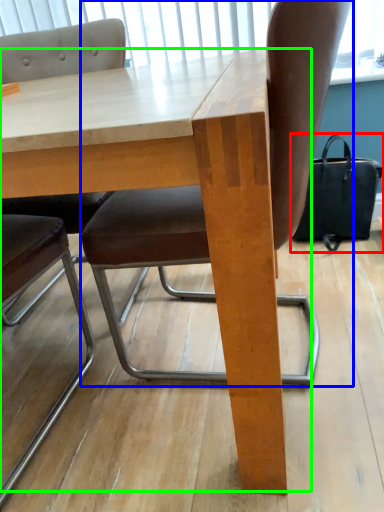
Question: Considering the real-world distances, which object is farthest from handbag (highlighted by a red box)? chair (highlighted by a blue box) or table (highlighted by a green box)?

Choices:
 (A) chair
 (B) table

Answer: (B)